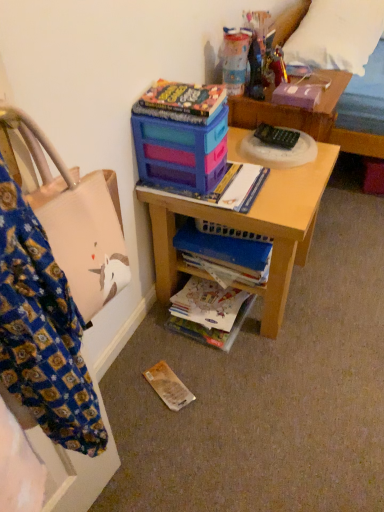
Identify the location of free area in between wooden desk at center and matte paper book at lower center, which appears as the first book when ordered from the bottom. (221, 347).